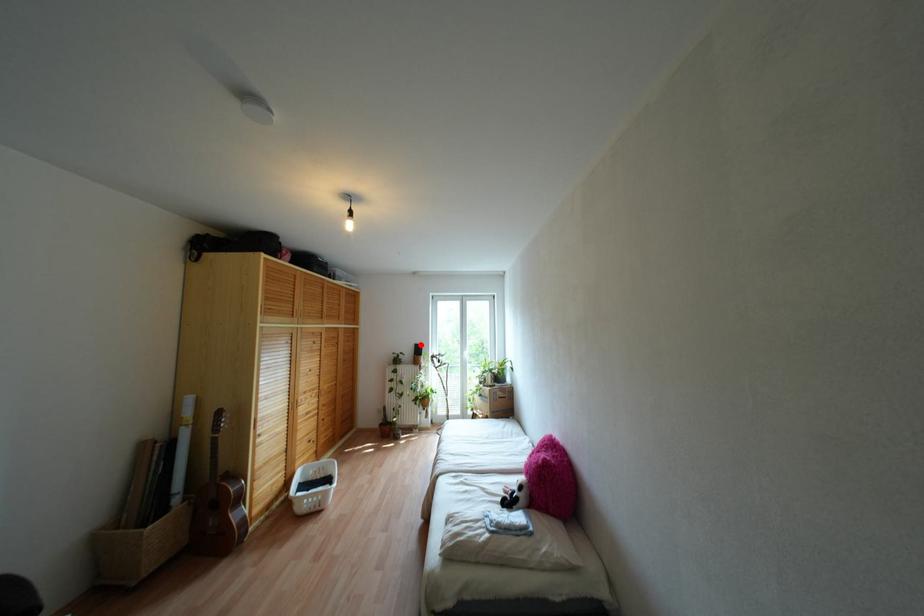
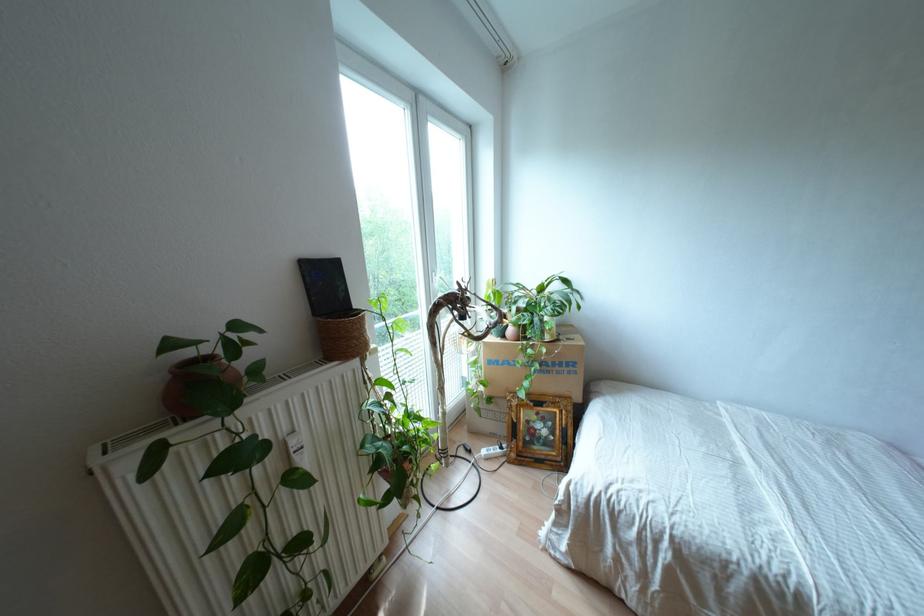
Locate, in the second image, the point that corresponds to the highlighted location in the first image.

(334, 262)